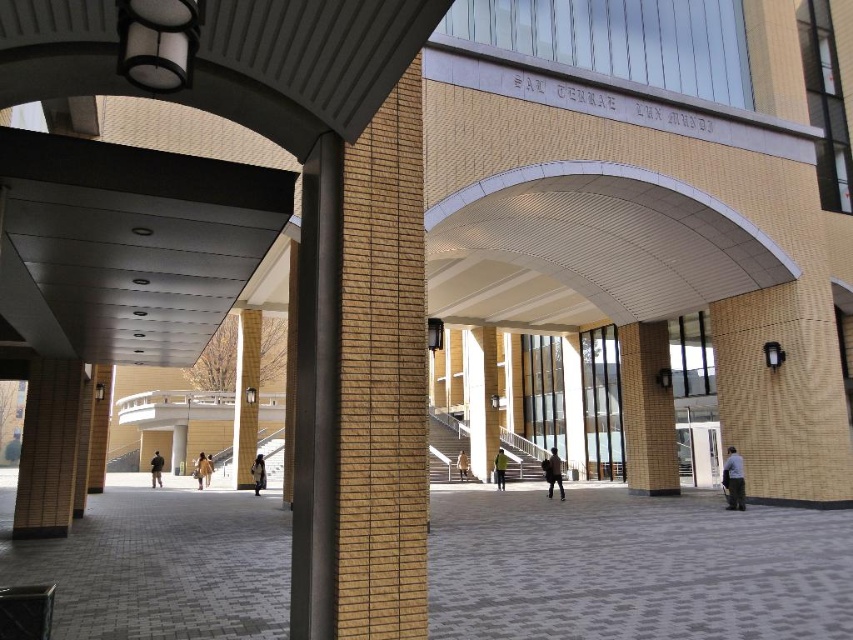
You are a photographer standing at the center of the scene. You want to take a photo of the dark gray pants at lower right and dark blue jeans at center. How far apart are these two objects from each other?

The dark gray pants at lower right is 29.19 feet away from dark blue jeans at center.